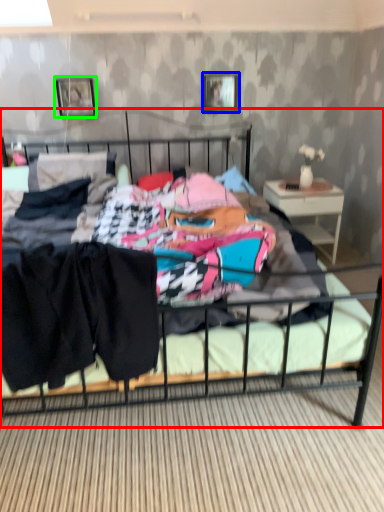
Question: Based on their relative distances, which object is nearer to bed (highlighted by a red box)? Choose from picture frame (highlighted by a blue box) and picture frame (highlighted by a green box).

Choices:
 (A) picture frame
 (B) picture frame

Answer: (A)